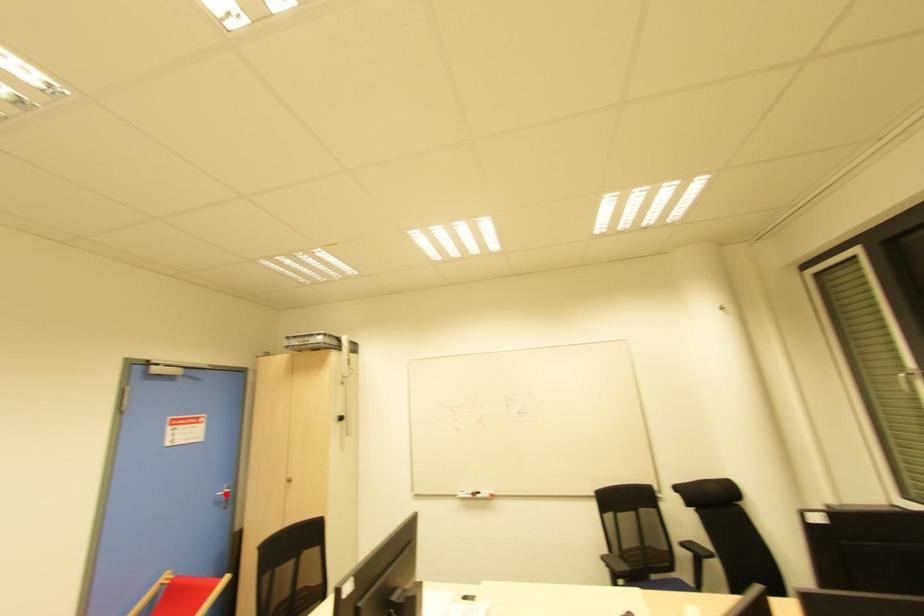
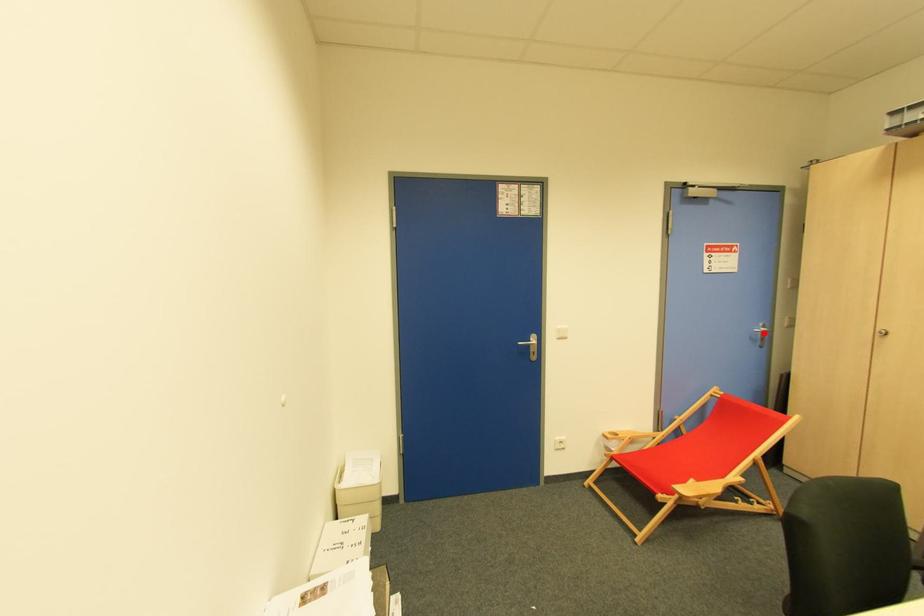
I am providing you with two images of the same scene from different viewpoints. A red point is marked on the first image and another point is marked on the second image. Are the points marked in image1 and image2 representing the same 3D position?

Yes